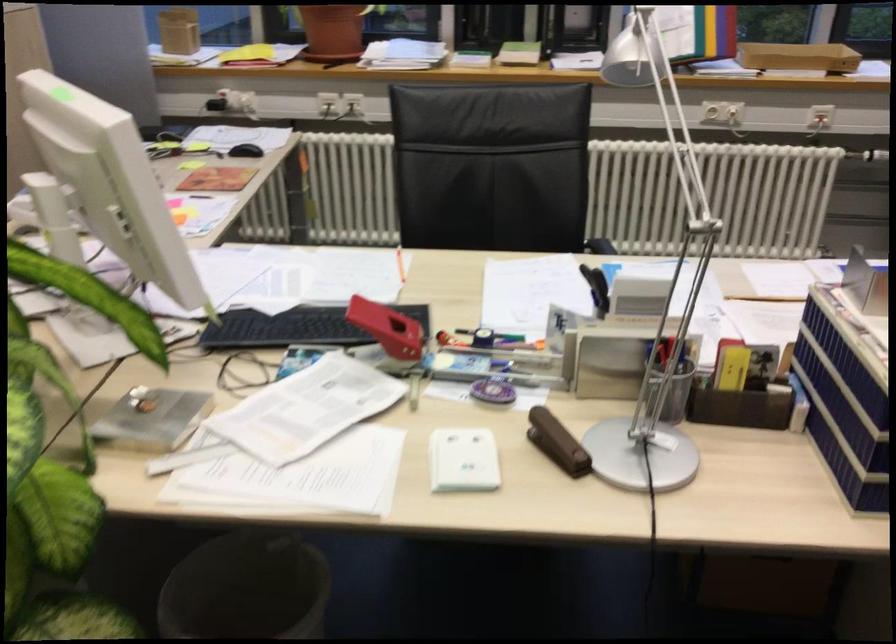
Where is `red pen`? red pen is located at coordinates (386, 328).